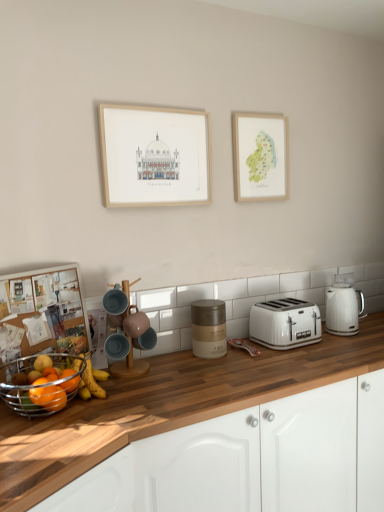
Question: Looking at the image, does white wood cabinetry at center seem bigger or smaller compared to matte ceramic coffee machine at center?

Choices:
 (A) big
 (B) small

Answer: (A)

Question: Considering the positions of point (269, 480) and point (130, 352), is point (269, 480) closer or farther from the camera than point (130, 352)?

Choices:
 (A) closer
 (B) farther

Answer: (A)

Question: Based on their relative distances, which object is farther from the white plastic toaster at center?

Choices:
 (A) matte blue mug at center, the 4th appliance in the right-to-left sequence
 (B) matte wooden picture frame at upper center, placed as the first picture frame when sorted from front to back
 (C) white wood cabinetry at center
 (D) matte ceramic coffee machine at center
 (E) white glossy electric kettle at right, which is the 4th appliance in front-to-back order

Answer: (B)

Question: Which object is the closest to the matte gold canister at center, the 2th appliance viewed from the right?

Choices:
 (A) watercolor paper map at upper right, the 2th picture frame in the front-to-back sequence
 (B) metallic silver fruit basket at lower left
 (C) white glossy electric kettle at right, which is the 4th appliance in left-to-right order
 (D) matte ceramic mug at center, acting as the 1th appliance starting from the front
 (E) matte blue mug at center, which appears as the 3th appliance when viewed from the back

Answer: (D)